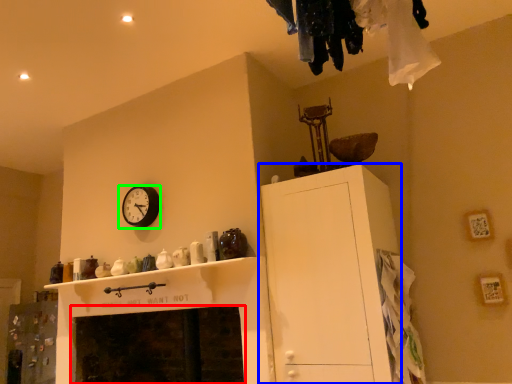
Question: Which is nearer to the fireplace (highlighted by a red box)? cabinetry (highlighted by a blue box) or wall clock (highlighted by a green box).

Choices:
 (A) cabinetry
 (B) wall clock

Answer: (B)